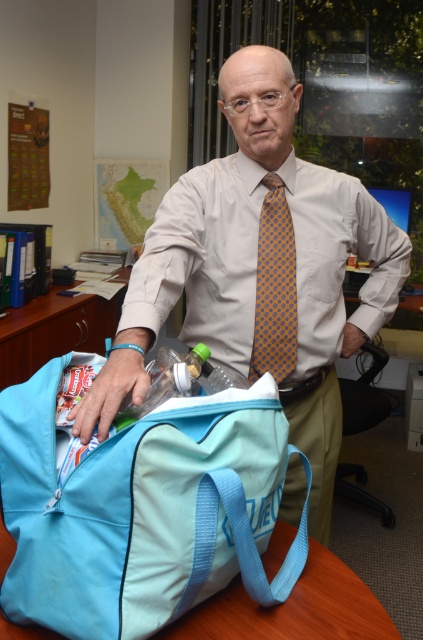
You are an office assistant who needs to determine if the matte blue duffel bag at center can fit inside a drawer that is exactly the same width as the yellow dotted tie at center. Can it fit?

The matte blue duffel bag at center is wider than the yellow dotted tie at center, so it cannot fit into the drawer that matches the tie width.

The man in the office is looking at the items on the table. Which object is located below the other between the matte blue duffel bag at center and the yellow dotted tie at center?

The matte blue duffel bag at center is positioned under the yellow dotted tie at center.

What are the coordinates of the matte blue duffel bag at center?

The coordinates of the matte blue duffel bag at center are at point (260, 269).